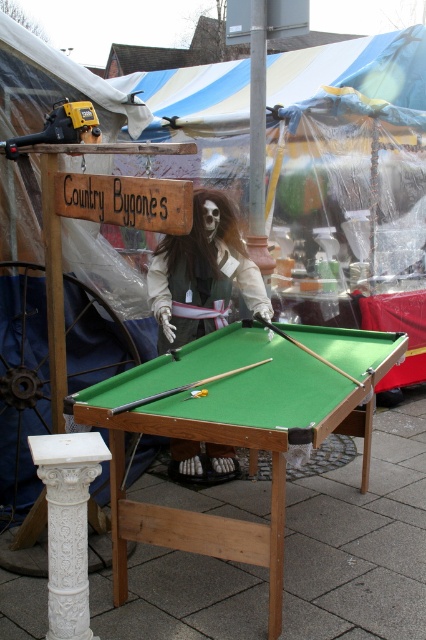
Can you confirm if green felt pool table at center is smaller than wooden smooth cue at center?

No, green felt pool table at center is not smaller than wooden smooth cue at center.

Locate an element on the screen. This screenshot has height=640, width=426. green felt pool table at center is located at coordinates (236, 429).

Find the location of a particular element. green felt pool table at center is located at coordinates (236, 429).

Can you confirm if white fabric skeleton at center is wider than smooth wood cue at center?

Indeed, white fabric skeleton at center has a greater width compared to smooth wood cue at center.

Does white fabric skeleton at center have a lesser width compared to smooth wood cue at center?

Incorrect, white fabric skeleton at center's width is not less than smooth wood cue at center's.

Identify the location of white fabric skeleton at center. The width and height of the screenshot is (426, 640). (201, 273).

Is green felt pool table at center taller than smooth wood cue at center?

Indeed, green felt pool table at center has a greater height compared to smooth wood cue at center.

Does point (339, 333) come in front of point (270, 326)?

No, (339, 333) is behind (270, 326).

Is point (270, 616) positioned in front of point (267, 321)?

Yes, point (270, 616) is closer to viewer.

At what (x,y) coordinates should I click in order to perform the action: click on green felt pool table at center. Please return your answer as a coordinate pair (x, y). Image resolution: width=426 pixels, height=640 pixels. Looking at the image, I should click on (236, 429).